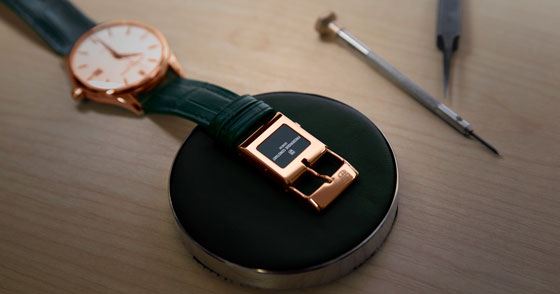
Find the location of a particular element. The width and height of the screenshot is (560, 294). latch is located at coordinates (297, 165).